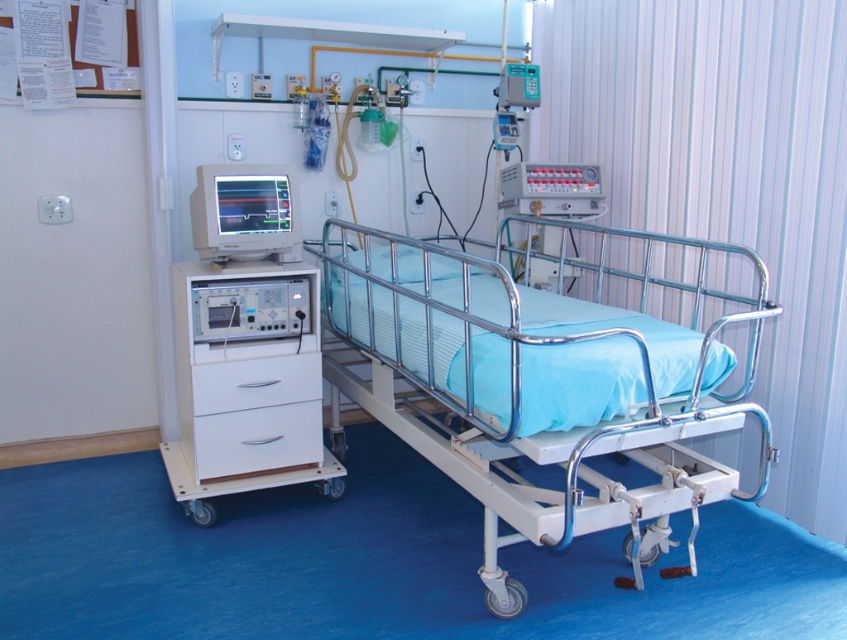
Can you confirm if metallic blue bed at center is positioned below white matte drawer at center?

No, metallic blue bed at center is not below white matte drawer at center.

Who is more forward, (635, 438) or (313, 394)?

Point (635, 438)

Who is more distant from viewer, (408, 307) or (227, 374)?

The point (227, 374) is more distant.

Image resolution: width=847 pixels, height=640 pixels. Find the location of `metallic blue bed at center`. metallic blue bed at center is located at coordinates (534, 385).

Between point (202, 172) and point (256, 360), which one is positioned behind?

Point (256, 360)

Can you confirm if matte silver monitor at center-left is bigger than white matte drawer at center?

Correct, matte silver monitor at center-left is larger in size than white matte drawer at center.

Is point (203, 173) closer to viewer compared to point (314, 374)?

Yes.

What are the coordinates of `matte silver monitor at center-left` in the screenshot? It's located at (245, 212).

Between matte silver monitor at center-left and white glossy drawer at lower left, which one is positioned lower?

white glossy drawer at lower left is lower down.

Does matte silver monitor at center-left have a greater width compared to white glossy drawer at lower left?

No, matte silver monitor at center-left is not wider than white glossy drawer at lower left.

Who is more forward, (197, 228) or (309, 465)?

Point (197, 228) is in front.

Where is `matte silver monitor at center-left`? matte silver monitor at center-left is located at coordinates (245, 212).